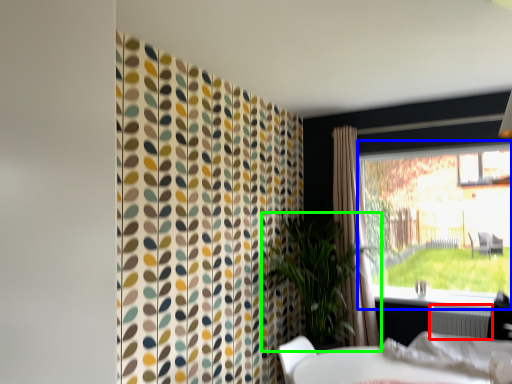
Question: Estimate the real-world distances between objects in this image. Which object is farther from radiator (highlighted by a red box), window (highlighted by a blue box) or houseplant (highlighted by a green box)?

Choices:
 (A) window
 (B) houseplant

Answer: (A)